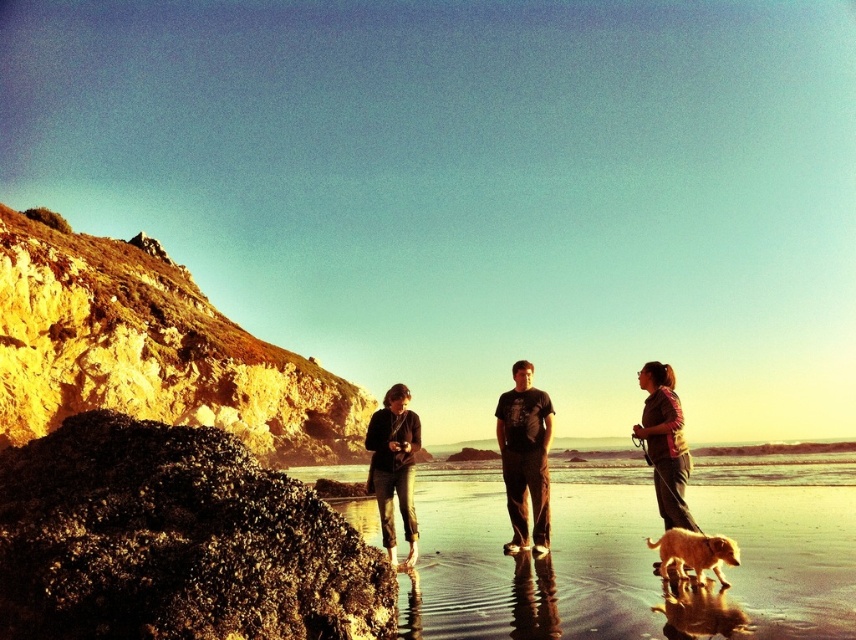
Can you confirm if black cotton t-shirt at center is shorter than dark gray sweater at center?

No, black cotton t-shirt at center is not shorter than dark gray sweater at center.

Is point (509, 461) positioned after point (399, 492)?

Yes, point (509, 461) is farther from viewer.

Is point (510, 401) positioned behind point (405, 444)?

Yes, it is.

Locate an element on the screen. black cotton t-shirt at center is located at coordinates (525, 458).

Which is more to the right, smooth sand beach at center or dark gray sweater at center?

smooth sand beach at center

Is smooth sand beach at center positioned at the back of dark gray sweater at center?

That is False.

Between point (736, 502) and point (385, 396), which one is positioned behind?

The point (736, 502) is more distant.

The width and height of the screenshot is (856, 640). I want to click on smooth sand beach at center, so click(629, 564).

Who is taller, brown leather jacket at lower right or golden fur dog at lower right?

With more height is brown leather jacket at lower right.

Who is more distant from viewer, (x=681, y=472) or (x=730, y=548)?

Point (x=681, y=472)

What do you see at coordinates (664, 444) in the screenshot?
I see `brown leather jacket at lower right` at bounding box center [664, 444].

This screenshot has height=640, width=856. I want to click on brown leather jacket at lower right, so pyautogui.click(x=664, y=444).